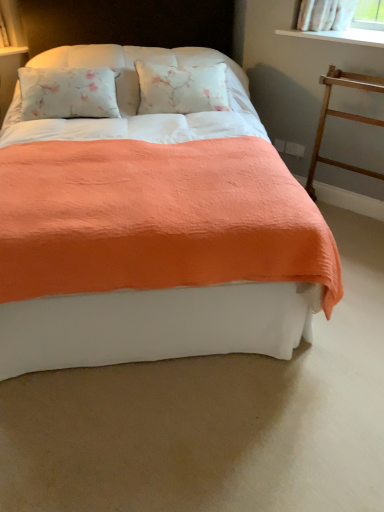
Question: Is wooden at right not near coral fabric bed at center?

Choices:
 (A) yes
 (B) no

Answer: (A)

Question: Is wooden at right further to the viewer compared to coral fabric bed at center?

Choices:
 (A) no
 (B) yes

Answer: (B)

Question: Does wooden at right have a lesser width compared to coral fabric bed at center?

Choices:
 (A) no
 (B) yes

Answer: (B)

Question: Can you confirm if wooden at right is wider than coral fabric bed at center?

Choices:
 (A) yes
 (B) no

Answer: (B)

Question: Considering the relative positions of wooden at right and coral fabric bed at center in the image provided, is wooden at right to the right of coral fabric bed at center from the viewer's perspective?

Choices:
 (A) yes
 (B) no

Answer: (A)

Question: From the image's perspective, relative to coral fabric bed at center, is wooden at right above or below?

Choices:
 (A) above
 (B) below

Answer: (B)

Question: Considering the positions of point (319, 140) and point (142, 117), is point (319, 140) closer or farther from the camera than point (142, 117)?

Choices:
 (A) farther
 (B) closer

Answer: (A)

Question: In terms of height, does wooden at right look taller or shorter compared to coral fabric bed at center?

Choices:
 (A) short
 (B) tall

Answer: (A)

Question: From a real-world perspective, relative to coral fabric bed at center, is wooden at right vertically above or below?

Choices:
 (A) below
 (B) above

Answer: (A)

Question: From a real-world perspective, is coral fabric bed at center physically located above or below wooden at right?

Choices:
 (A) above
 (B) below

Answer: (A)

Question: Based on their positions, is coral fabric bed at center located to the left or right of wooden at right?

Choices:
 (A) right
 (B) left

Answer: (B)

Question: From their relative heights in the image, would you say coral fabric bed at center is taller or shorter than wooden at right?

Choices:
 (A) tall
 (B) short

Answer: (A)

Question: Considering the positions of point (x=66, y=276) and point (x=311, y=156), is point (x=66, y=276) closer or farther from the camera than point (x=311, y=156)?

Choices:
 (A) closer
 (B) farther

Answer: (A)

Question: Based on their sizes in the image, would you say white smooth window sill at upper right is bigger or smaller than coral fabric bed at center?

Choices:
 (A) small
 (B) big

Answer: (A)

Question: Visually, is white smooth window sill at upper right positioned to the left or to the right of coral fabric bed at center?

Choices:
 (A) left
 (B) right

Answer: (B)